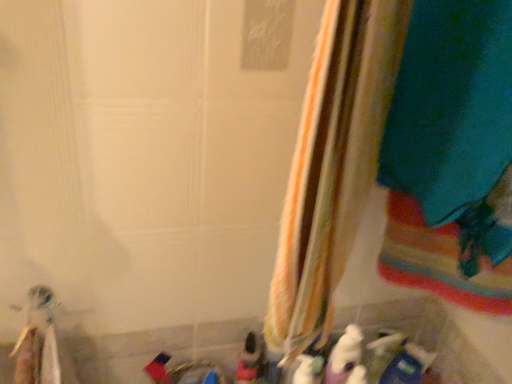
Question: Is striped fabric curtain at center wider than matte plastic toy at lower center, acting as the 2th toy starting from the left?

Choices:
 (A) no
 (B) yes

Answer: (B)

Question: Is striped fabric curtain at center positioned in front of matte plastic toy at lower center, acting as the 2th toy starting from the left?

Choices:
 (A) yes
 (B) no

Answer: (A)

Question: Considering the relative sizes of striped fabric curtain at center and matte plastic toy at lower center, acting as the 4th toy starting from the right, in the image provided, is striped fabric curtain at center smaller than matte plastic toy at lower center, acting as the 4th toy starting from the right,?

Choices:
 (A) yes
 (B) no

Answer: (B)

Question: Are striped fabric curtain at center and matte plastic toy at lower center, acting as the 2th toy starting from the left, located far from each other?

Choices:
 (A) yes
 (B) no

Answer: (B)

Question: Can you confirm if striped fabric curtain at center is positioned to the left of matte plastic toy at lower center, acting as the 4th toy starting from the right?

Choices:
 (A) no
 (B) yes

Answer: (A)

Question: Considering the relative sizes of striped fabric curtain at center and matte plastic toy at lower center, acting as the 4th toy starting from the right, in the image provided, is striped fabric curtain at center shorter than matte plastic toy at lower center, acting as the 4th toy starting from the right,?

Choices:
 (A) no
 (B) yes

Answer: (A)

Question: Is white plush toy at lower center, which is the 3th toy from right to left, at the right side of white plastic toothbrush at lower left, the first toy from the left?

Choices:
 (A) no
 (B) yes

Answer: (B)

Question: Are white plush toy at lower center, which is the 3th toy from right to left, and white plastic toothbrush at lower left, which ranks as the fifth toy in right-to-left order, located far from each other?

Choices:
 (A) yes
 (B) no

Answer: (B)

Question: Does white plush toy at lower center, which is the 3th toy from right to left, have a lesser width compared to white plastic toothbrush at lower left, the first toy from the left?

Choices:
 (A) no
 (B) yes

Answer: (B)

Question: Can you confirm if white plush toy at lower center, marked as the 3th toy in a left-to-right arrangement, is taller than white plastic toothbrush at lower left, which ranks as the fifth toy in right-to-left order?

Choices:
 (A) no
 (B) yes

Answer: (A)

Question: Does white plush toy at lower center, which is the 3th toy from right to left, come in front of white plastic toothbrush at lower left, which ranks as the fifth toy in right-to-left order?

Choices:
 (A) yes
 (B) no

Answer: (B)

Question: Could you tell me if white plush toy at lower center, marked as the 3th toy in a left-to-right arrangement, is facing white plastic toothbrush at lower left, which ranks as the fifth toy in right-to-left order?

Choices:
 (A) no
 (B) yes

Answer: (A)

Question: Does blue plastic toy at lower right, which is the fifth toy from left to right, appear on the right side of white plastic toothbrush at lower left, which ranks as the fifth toy in right-to-left order?

Choices:
 (A) yes
 (B) no

Answer: (A)